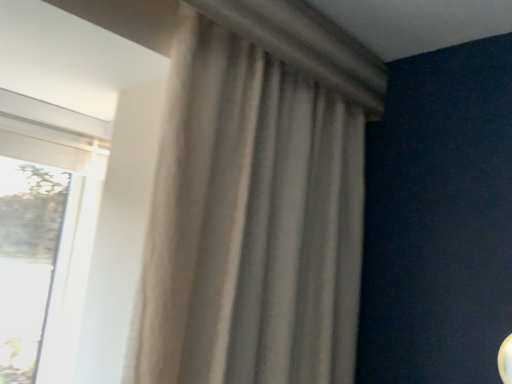
Locate an element on the screen. This screenshot has height=384, width=512. beige fabric curtain at center is located at coordinates pos(251,222).

Describe the element at coordinates (251, 222) in the screenshot. This screenshot has width=512, height=384. I see `beige fabric curtain at center` at that location.

This screenshot has height=384, width=512. What do you see at coordinates (45, 232) in the screenshot?
I see `transparent glass window at left` at bounding box center [45, 232].

Identify the location of transparent glass window at left. (45, 232).

Measure the distance between point (26,122) and camera.

They are 5.19 feet apart.

Locate an element on the screen. beige fabric curtain at center is located at coordinates (251, 222).

Which is more to the left, beige fabric curtain at center or transparent glass window at left?

transparent glass window at left.

Considering the relative positions of beige fabric curtain at center and transparent glass window at left in the image provided, is beige fabric curtain at center behind transparent glass window at left?

No, the depth of beige fabric curtain at center is less than that of transparent glass window at left.

Considering the points (294, 324) and (1, 309), which point is in front, point (294, 324) or point (1, 309)?

The point (294, 324) is closer.

From the image's perspective, which is below, beige fabric curtain at center or transparent glass window at left?

transparent glass window at left.

Consider the image. From a real-world perspective, is beige fabric curtain at center positioned under transparent glass window at left based on gravity?

Actually, beige fabric curtain at center is physically above transparent glass window at left in the real world.

Does beige fabric curtain at center have a lesser width compared to transparent glass window at left?

No, beige fabric curtain at center is not thinner than transparent glass window at left.

Considering the relative sizes of beige fabric curtain at center and transparent glass window at left in the image provided, is beige fabric curtain at center shorter than transparent glass window at left?

Incorrect, the height of beige fabric curtain at center does not fall short of that of transparent glass window at left.

Considering the relative sizes of beige fabric curtain at center and transparent glass window at left in the image provided, is beige fabric curtain at center bigger than transparent glass window at left?

Correct, beige fabric curtain at center is larger in size than transparent glass window at left.

Is beige fabric curtain at center situated inside transparent glass window at left or outside?

beige fabric curtain at center is located beyond the bounds of transparent glass window at left.

Would you consider beige fabric curtain at center to be distant from transparent glass window at left?

Actually, beige fabric curtain at center and transparent glass window at left are a little close together.

Looking at this image, could you tell me if beige fabric curtain at center is facing transparent glass window at left?

No, beige fabric curtain at center is not facing towards transparent glass window at left.

How different are the orientations of beige fabric curtain at center and transparent glass window at left in degrees?

The angular difference between beige fabric curtain at center and transparent glass window at left is 0.386 degrees.

Locate an element on the screen. The width and height of the screenshot is (512, 384). window that appears below the beige fabric curtain at center (from the image's perspective) is located at coordinates (45, 232).

Which is more to the left, transparent glass window at left or beige fabric curtain at center?

transparent glass window at left.

Which is behind, transparent glass window at left or beige fabric curtain at center?

transparent glass window at left is behind.

Is point (46, 148) positioned behind point (172, 382)?

Yes, point (46, 148) is behind point (172, 382).

From the image's perspective, which is below, transparent glass window at left or beige fabric curtain at center?

From the image's view, transparent glass window at left is below.

From a real-world perspective, is transparent glass window at left over beige fabric curtain at center?

No.

Which of these two, transparent glass window at left or beige fabric curtain at center, is thinner?

With smaller width is transparent glass window at left.

Is transparent glass window at left taller than beige fabric curtain at center?

In fact, transparent glass window at left may be shorter than beige fabric curtain at center.

Is transparent glass window at left bigger than beige fabric curtain at center?

No, transparent glass window at left is not bigger than beige fabric curtain at center.

Is transparent glass window at left not inside beige fabric curtain at center?

Yes, transparent glass window at left is located beyond the bounds of beige fabric curtain at center.

Is transparent glass window at left far from beige fabric curtain at center?

They are positioned close to each other.

Is beige fabric curtain at center at the back of transparent glass window at left?

No, beige fabric curtain at center is not at the back of transparent glass window at left.

How far apart are transparent glass window at left and beige fabric curtain at center?

A distance of 85.74 centimeters exists between transparent glass window at left and beige fabric curtain at center.

Where is `curtain above the transparent glass window at left (from a real-world perspective)`? The height and width of the screenshot is (384, 512). curtain above the transparent glass window at left (from a real-world perspective) is located at coordinates (251, 222).

Where is `curtain above the transparent glass window at left (from a real-world perspective)`? The image size is (512, 384). curtain above the transparent glass window at left (from a real-world perspective) is located at coordinates (251, 222).

Find the location of a particular element. Image resolution: width=512 pixels, height=384 pixels. window below the beige fabric curtain at center (from a real-world perspective) is located at coordinates (45, 232).